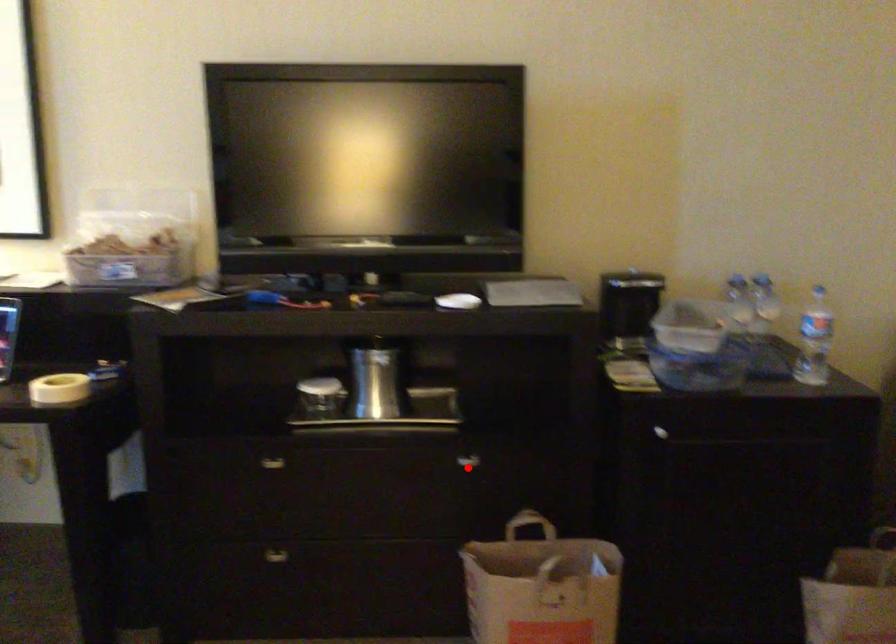
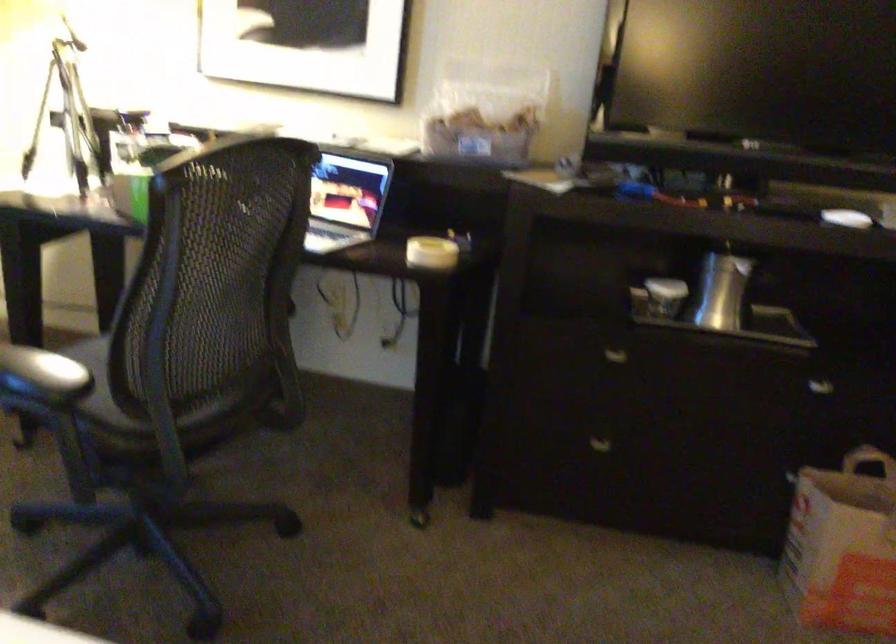
Locate, in the second image, the point that corresponds to the highlighted location in the first image.

(821, 389)